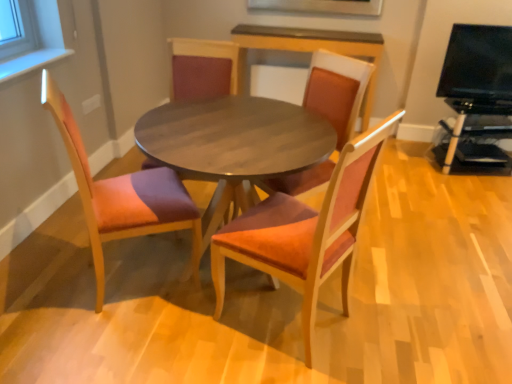
The height and width of the screenshot is (384, 512). I want to click on vacant point to the right of wooden round table at center, so click(412, 277).